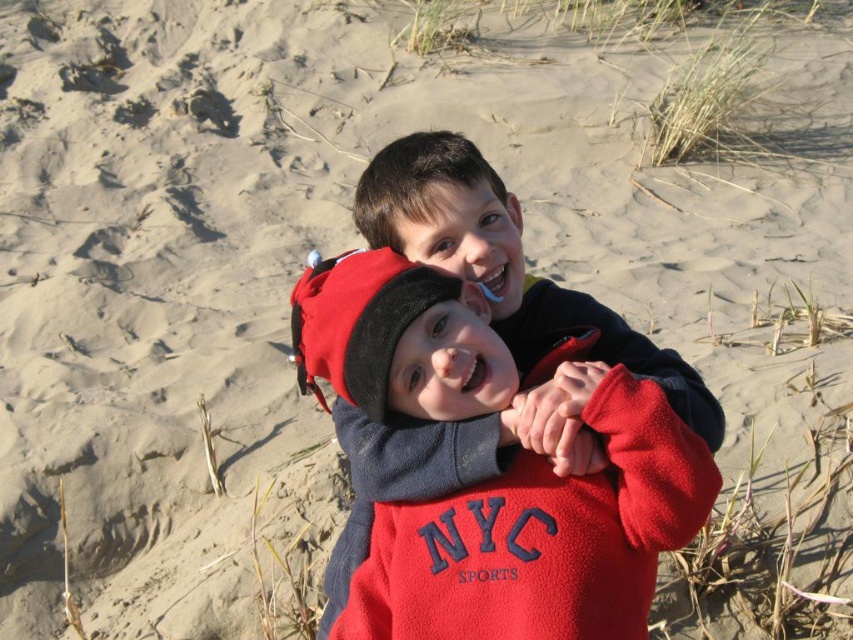
Between red fleece sweatshirt at center and matte black jacket at center, which one is positioned lower?

red fleece sweatshirt at center

What do you see at coordinates (502, 474) in the screenshot? The image size is (853, 640). I see `red fleece sweatshirt at center` at bounding box center [502, 474].

In order to click on red fleece sweatshirt at center in this screenshot , I will do `click(502, 474)`.